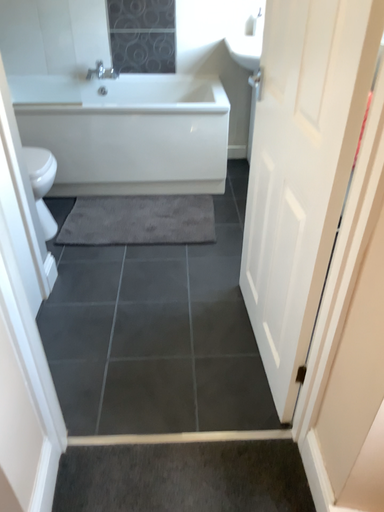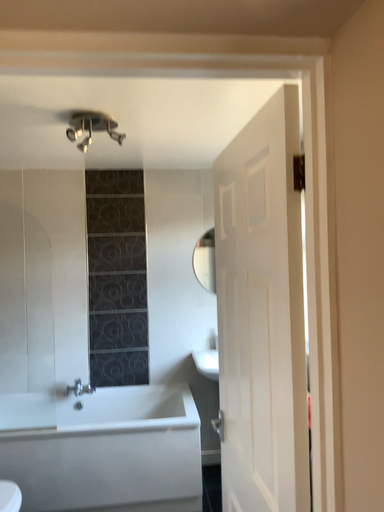
Question: How did the camera likely rotate when shooting the video?

Choices:
 (A) rotated upward
 (B) rotated downward

Answer: (A)